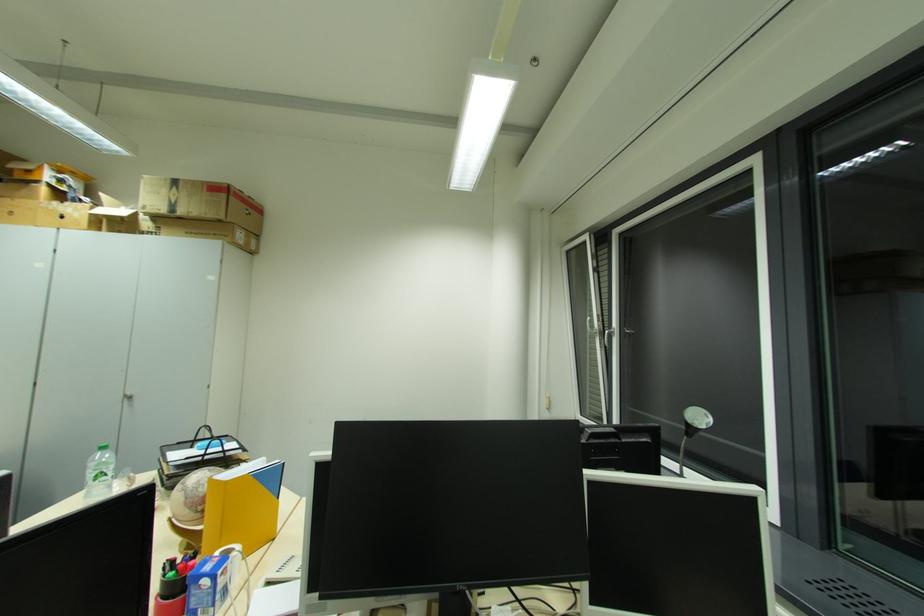
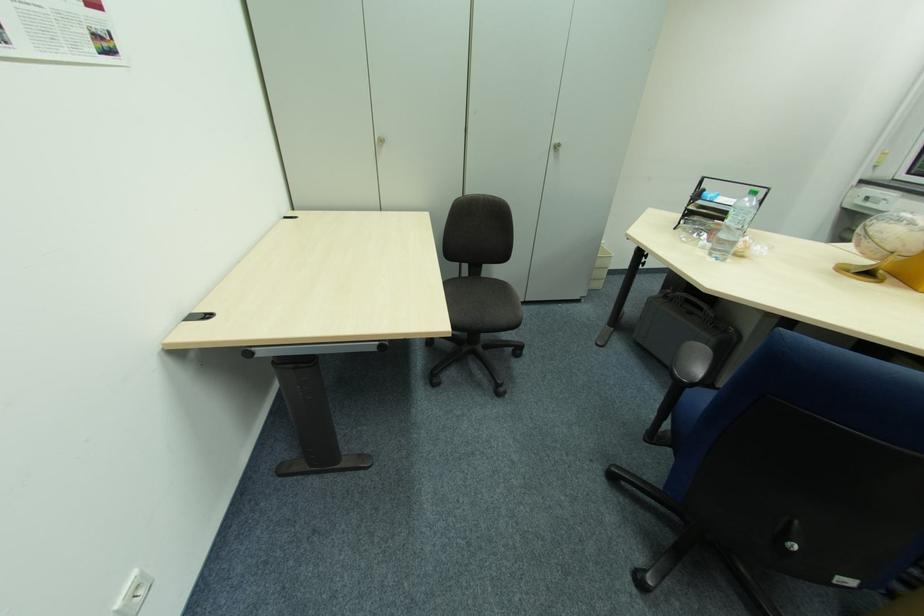
The point at [128,400] is marked in the first image. Where is the corresponding point in the second image?

(554, 150)